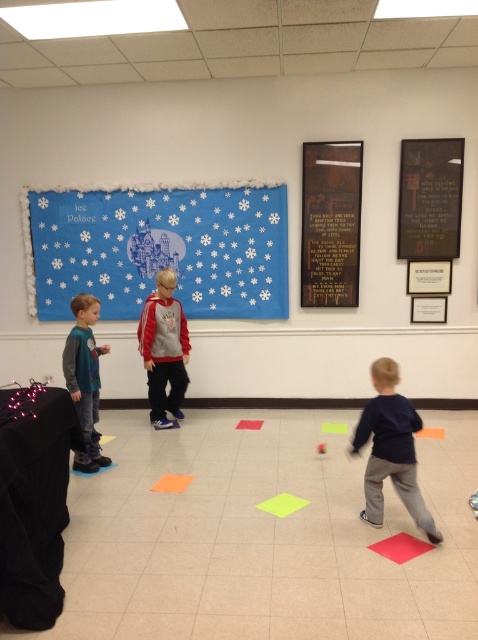
Does matte gray hoodie at left have a greater height compared to green paper at center?

Yes, matte gray hoodie at left is taller than green paper at center.

What do you see at coordinates (85, 380) in the screenshot?
I see `matte gray hoodie at left` at bounding box center [85, 380].

Is point (82, 388) positioned in front of point (338, 426)?

Yes.

Image resolution: width=478 pixels, height=640 pixels. What are the coordinates of `matte gray hoodie at left` in the screenshot? It's located at (85, 380).

Which is below, matte red hoodie at center or orange matte mat at center?

orange matte mat at center is lower down.

Is matte red hoodie at center closer to camera compared to orange matte mat at center?

No, matte red hoodie at center is behind orange matte mat at center.

Is point (156, 305) in front of point (158, 483)?

No, it is not.

You are a GUI agent. You are given a task and a screenshot of the screen. Output one action in this format:
    pyautogui.click(x=<x>, y=<y>)
    Task: Click on the matte red hoodie at center
    This screenshot has width=478, height=640.
    Given the screenshot: What is the action you would take?
    pyautogui.click(x=163, y=348)

Locate an element on the screen. wooden plaque at upper center is located at coordinates (x=330, y=224).

Looking at this image, can you confirm if wooden plaque at upper center is positioned to the right of matte red hoodie at center?

Yes, wooden plaque at upper center is to the right of matte red hoodie at center.

The height and width of the screenshot is (640, 478). Describe the element at coordinates (330, 224) in the screenshot. I see `wooden plaque at upper center` at that location.

Locate an element on the screen. The width and height of the screenshot is (478, 640). wooden plaque at upper center is located at coordinates (330, 224).